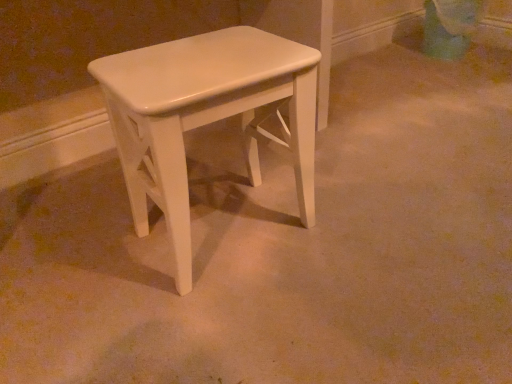
Question: In the image, is matte green swivel chair at upper right positioned in front of or behind white glossy stool at center?

Choices:
 (A) front
 (B) behind

Answer: (B)

Question: From a real-world perspective, is matte green swivel chair at upper right above or below white glossy stool at center?

Choices:
 (A) above
 (B) below

Answer: (B)

Question: Considering the relative positions of matte green swivel chair at upper right and white glossy stool at center in the image provided, is matte green swivel chair at upper right to the left or to the right of white glossy stool at center?

Choices:
 (A) right
 (B) left

Answer: (A)

Question: From the image's perspective, is white glossy stool at center positioned above or below matte green swivel chair at upper right?

Choices:
 (A) above
 (B) below

Answer: (B)

Question: In the image, is white glossy stool at center positioned in front of or behind matte green swivel chair at upper right?

Choices:
 (A) behind
 (B) front

Answer: (B)

Question: Which is correct: white glossy stool at center is inside matte green swivel chair at upper right, or outside of it?

Choices:
 (A) inside
 (B) outside

Answer: (B)

Question: Considering the relative positions of white glossy stool at center and matte green swivel chair at upper right in the image provided, is white glossy stool at center to the left or to the right of matte green swivel chair at upper right?

Choices:
 (A) left
 (B) right

Answer: (A)